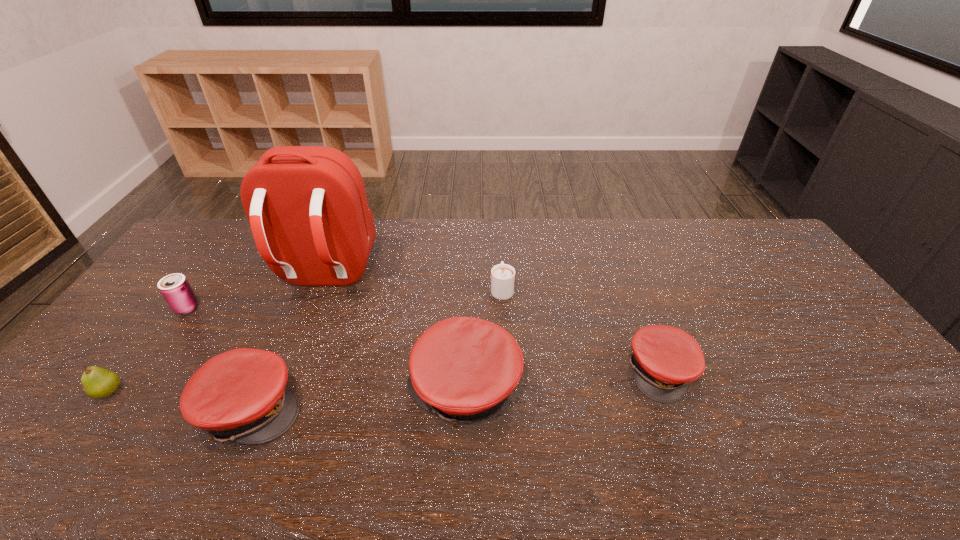
The caps are evenly distributed in the image. To maintain this, where would you place another cap on the right? Please point to a free space. Please provide its 2D coordinates. Your answer should be formatted as a tuple, i.e. [(x, y)], where the tuple contains the x and y coordinates of a point satisfying the conditions above.

[(845, 355)]